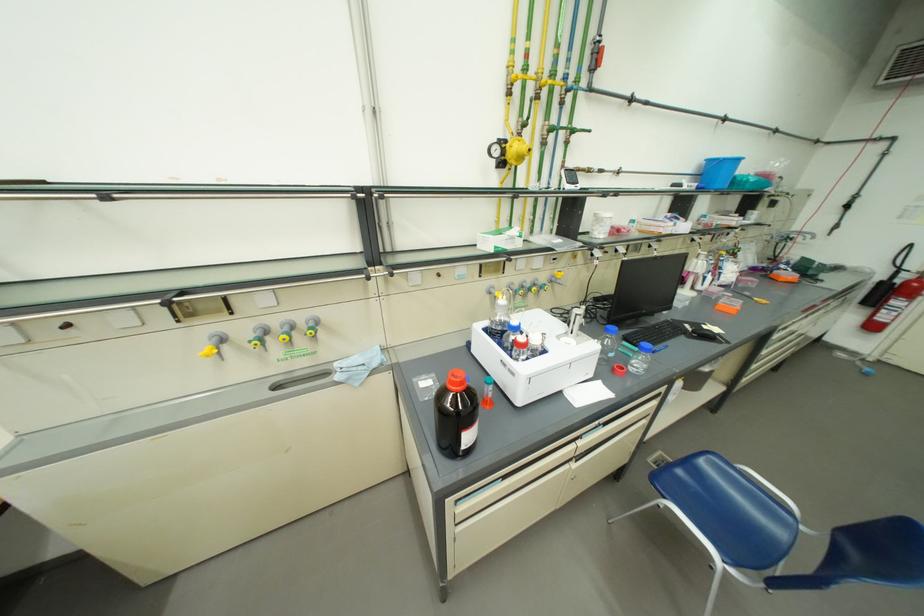
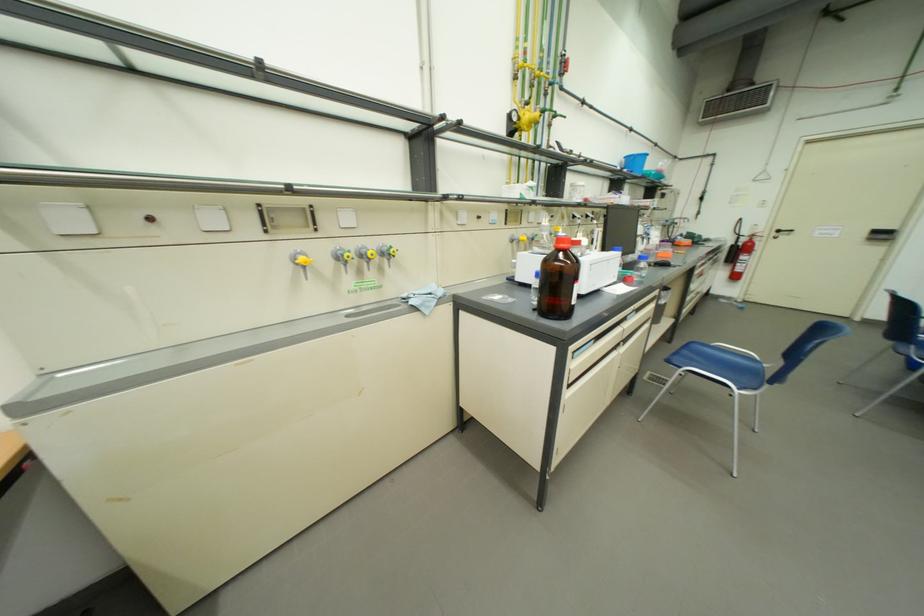
Where in the second image is the point corresponding to pixel 725 416 from the first image?

(681, 345)